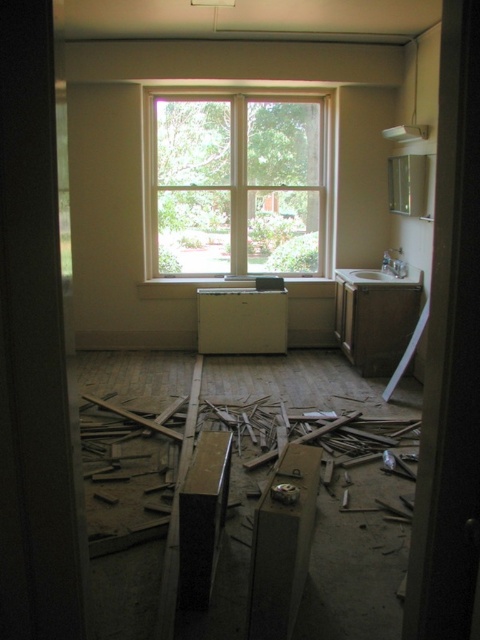
You are a plumber inspecting a renovated kitchen. You see the white matte sink at right and the white matte radiator at center. Which object is positioned to the right of the other?

The white matte sink at right is positioned to the right of the white matte radiator at center.